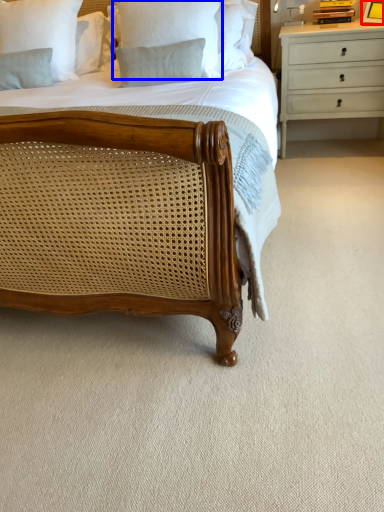
Question: Which of the following is the farthest to the observer, picture frame (highlighted by a red box) or pillow (highlighted by a blue box)?

Choices:
 (A) picture frame
 (B) pillow

Answer: (A)